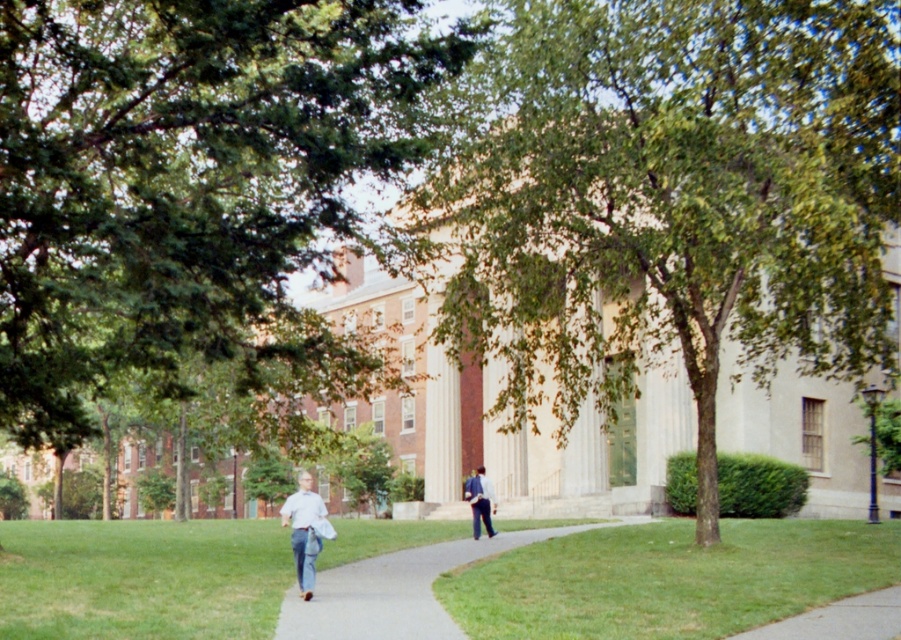
I want to click on gray concrete pavement at lower right, so click(x=839, y=620).

Does point (886, 618) lie behind point (292, 499)?

No, (886, 618) is closer to viewer.

Where is `gray concrete pavement at lower right`? This screenshot has height=640, width=901. gray concrete pavement at lower right is located at coordinates tap(839, 620).

Between green grass at center and light blue jeans at center, which one has more height?

With more height is light blue jeans at center.

Which is more to the right, green grass at center or light blue jeans at center?

Positioned to the right is green grass at center.

Describe the element at coordinates (669, 579) in the screenshot. I see `green grass at center` at that location.

The image size is (901, 640). What are the coordinates of `green grass at center` in the screenshot? It's located at (669, 579).

Is point (292, 528) farther from viewer compared to point (488, 493)?

No.

Does point (285, 518) come closer to viewer compared to point (481, 516)?

Yes, point (285, 518) is in front of point (481, 516).

Image resolution: width=901 pixels, height=640 pixels. Find the location of `light blue denim jeans at center`. light blue denim jeans at center is located at coordinates (303, 531).